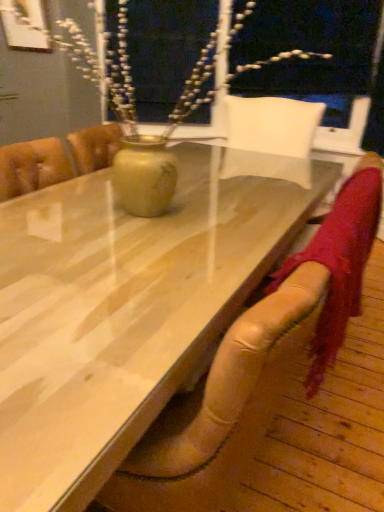
Find the location of a particular element. This screenshot has width=384, height=512. wooden table at center is located at coordinates (66, 420).

What do you see at coordinates (66, 420) in the screenshot? I see `wooden table at center` at bounding box center [66, 420].

Measure the distance between point (68, 362) and camera.

The depth of point (68, 362) is 31.65 inches.

What is the approximate height of leather armchair at lower right?

36.90 inches.

Describe the element at coordinates (234, 384) in the screenshot. I see `leather armchair at lower right` at that location.

You are a GUI agent. You are given a task and a screenshot of the screen. Output one action in this format:
    pyautogui.click(x=<x>, y=<y>)
    Task: Click on the leather armchair at lower right
    The width and height of the screenshot is (384, 512).
    Given the screenshot: What is the action you would take?
    pyautogui.click(x=234, y=384)

What is the approximate width of leather armchair at lower right?

leather armchair at lower right is 25.27 inches in width.

You are a GUI agent. You are given a task and a screenshot of the screen. Output one action in this format:
    pyautogui.click(x=<x>, y=<y>)
    Task: Click on the wooden table at center
    The width and height of the screenshot is (384, 512).
    Given the screenshot: What is the action you would take?
    pyautogui.click(x=66, y=420)

Considering the positions of objects wooden table at center and leather armchair at lower right in the image provided, who is more to the left, wooden table at center or leather armchair at lower right?

wooden table at center.

Which is in front, wooden table at center or leather armchair at lower right?

wooden table at center is more forward.

From the picture: Which point is more distant from viewer, (x=162, y=329) or (x=201, y=403)?

Point (x=201, y=403)

From the image's perspective, between wooden table at center and leather armchair at lower right, which one is located above?

wooden table at center is shown above in the image.

Based on the photo, from a real-world perspective, which is physically above, wooden table at center or leather armchair at lower right?

leather armchair at lower right, from a real-world perspective.

Which object is thinner, wooden table at center or leather armchair at lower right?

leather armchair at lower right is thinner.

Is wooden table at center taller or shorter than leather armchair at lower right?

wooden table at center is shorter than leather armchair at lower right.

Considering the sizes of objects wooden table at center and leather armchair at lower right in the image provided, who is bigger, wooden table at center or leather armchair at lower right?

Bigger between the two is wooden table at center.

Is wooden table at center spatially inside leather armchair at lower right, or outside of it?

wooden table at center is located beyond the bounds of leather armchair at lower right.

Is wooden table at center not near leather armchair at lower right?

No.

Consider the image. Is leather armchair at lower right at the back of wooden table at center?

wooden table at center is not turned away from leather armchair at lower right.

Can you tell me how much wooden table at center and leather armchair at lower right differ in facing direction?

There is a 91.8-degree angle between the facing directions of wooden table at center and leather armchair at lower right.

Identify the location of table above the leather armchair at lower right (from the image's perspective). (66, 420).

Considering the relative positions of leather armchair at lower right and wooden table at center in the image provided, is leather armchair at lower right to the left or to the right of wooden table at center?

In the image, leather armchair at lower right appears on the right side of wooden table at center.

Is leather armchair at lower right positioned behind wooden table at center?

That is True.

Between point (294, 289) and point (141, 366), which one is positioned behind?

The point (141, 366) is farther.

From the image's perspective, would you say leather armchair at lower right is shown under wooden table at center?

Correct, leather armchair at lower right appears lower than wooden table at center in the image.

In the scene shown: From a real-world perspective, who is located higher, leather armchair at lower right or wooden table at center?

leather armchair at lower right is physically above.

Considering the relative sizes of leather armchair at lower right and wooden table at center in the image provided, is leather armchair at lower right wider than wooden table at center?

No, leather armchair at lower right is not wider than wooden table at center.

Is leather armchair at lower right shorter than wooden table at center?

No.

Is leather armchair at lower right smaller than wooden table at center?

Correct, leather armchair at lower right occupies less space than wooden table at center.

Is wooden table at center a part of leather armchair at lower right?

No, wooden table at center is not inside leather armchair at lower right.

Based on the photo, are leather armchair at lower right and wooden table at center beside each other?

No, leather armchair at lower right is not beside wooden table at center.

Is leather armchair at lower right turned away from wooden table at center?

Yes, leather armchair at lower right's orientation is away from wooden table at center.

How different are the orientations of leather armchair at lower right and wooden table at center in degrees?

They differ by 91.8 degrees in their facing directions.

Find the location of `table located in front of the leather armchair at lower right`. table located in front of the leather armchair at lower right is located at coordinates (66, 420).

Identify the location of table that is in front of the leather armchair at lower right. The width and height of the screenshot is (384, 512). (x=66, y=420).

This screenshot has height=512, width=384. I want to click on armchair that is above the wooden table at center (from a real-world perspective), so click(x=234, y=384).